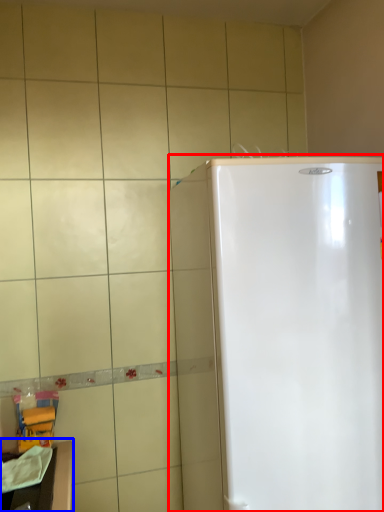
Question: Which point is closer to the camera, refrigerator (highlighted by a red box) or counter top (highlighted by a blue box)?

Choices:
 (A) refrigerator
 (B) counter top

Answer: (A)